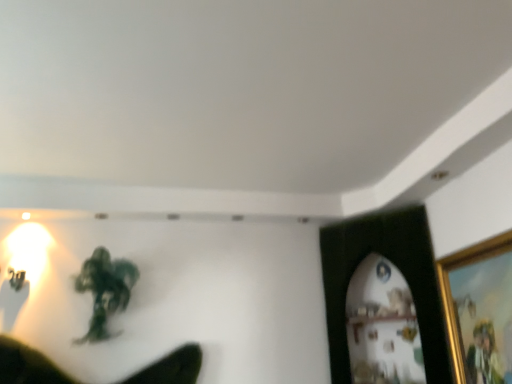
Question: Can you confirm if gold-framed picture at right, marked as the second picture frame in a back-to-front arrangement, is thinner than green matte figure at center?

Choices:
 (A) no
 (B) yes

Answer: (B)

Question: Can you confirm if gold-framed picture at right, which is the first picture frame from front to back, is wider than green matte figure at center?

Choices:
 (A) no
 (B) yes

Answer: (A)

Question: From the image's perspective, is gold-framed picture at right, which is the first picture frame from front to back, on green matte figure at center?

Choices:
 (A) no
 (B) yes

Answer: (B)

Question: Are gold-framed picture at right, marked as the second picture frame in a back-to-front arrangement, and green matte figure at center located far from each other?

Choices:
 (A) no
 (B) yes

Answer: (B)

Question: Can you confirm if gold-framed picture at right, which is the first picture frame from front to back, is taller than green matte figure at center?

Choices:
 (A) yes
 (B) no

Answer: (A)

Question: From a real-world perspective, is gold-framed picture at right, marked as the second picture frame in a back-to-front arrangement, located beneath green matte figure at center?

Choices:
 (A) yes
 (B) no

Answer: (A)

Question: Can you confirm if green matte figure at center is positioned to the left of gold-framed picture at right, which is the first picture frame from front to back?

Choices:
 (A) yes
 (B) no

Answer: (A)

Question: Is green matte figure at center far from gold-framed picture at right, which is the first picture frame from front to back?

Choices:
 (A) no
 (B) yes

Answer: (B)

Question: Is green matte figure at center behind gold-framed picture at right, which is the first picture frame from front to back?

Choices:
 (A) no
 (B) yes

Answer: (B)

Question: From the image's perspective, does green matte figure at center appear higher than gold-framed picture at right, marked as the second picture frame in a back-to-front arrangement?

Choices:
 (A) yes
 (B) no

Answer: (B)

Question: Is green matte figure at center surrounding gold-framed picture at right, which is the first picture frame from front to back?

Choices:
 (A) no
 (B) yes

Answer: (A)

Question: Is green matte figure at center bigger than gold-framed picture at right, which is the first picture frame from front to back?

Choices:
 (A) yes
 (B) no

Answer: (A)

Question: Does gold-framed picture at right, which is the first picture frame from front to back, appear on the left side of black matte picture frame at upper right, the first picture frame positioned from the back?

Choices:
 (A) no
 (B) yes

Answer: (A)